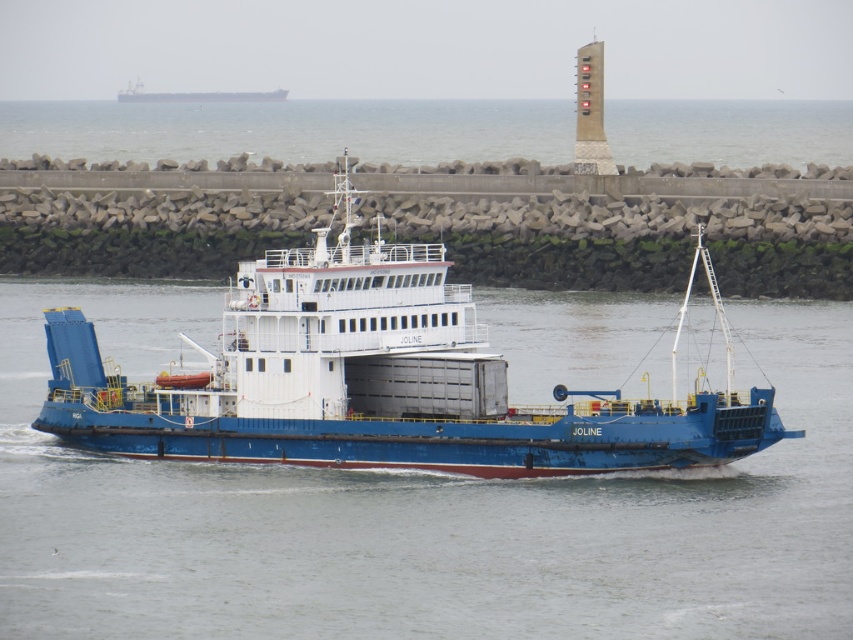
Question: Is blue metallic water at center above gray concrete water at center?

Choices:
 (A) no
 (B) yes

Answer: (A)

Question: Which point is closer to the camera taking this photo?

Choices:
 (A) (488, 148)
 (B) (573, 380)
 (C) (119, 422)

Answer: (C)

Question: Observing the image, what is the correct spatial positioning of blue metallic water at center in reference to blue matte cargo ship at upper left?

Choices:
 (A) right
 (B) left

Answer: (A)

Question: Considering the relative positions of blue matte cargo ship at center and blue matte cargo ship at upper left in the image provided, where is blue matte cargo ship at center located with respect to blue matte cargo ship at upper left?

Choices:
 (A) above
 (B) below

Answer: (B)

Question: Based on their relative distances, which object is nearer to the gray concrete water at center?

Choices:
 (A) blue metallic water at center
 (B) blue matte cargo ship at upper left
 (C) blue matte cargo ship at center

Answer: (B)

Question: Which point is farther to the camera?

Choices:
 (A) blue matte cargo ship at center
 (B) blue matte cargo ship at upper left
 (C) blue metallic water at center

Answer: (B)